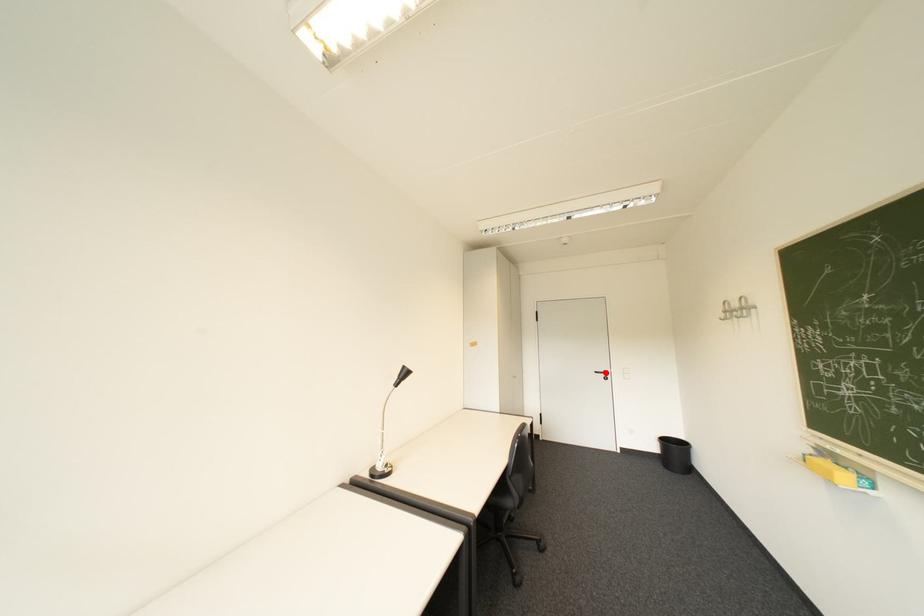
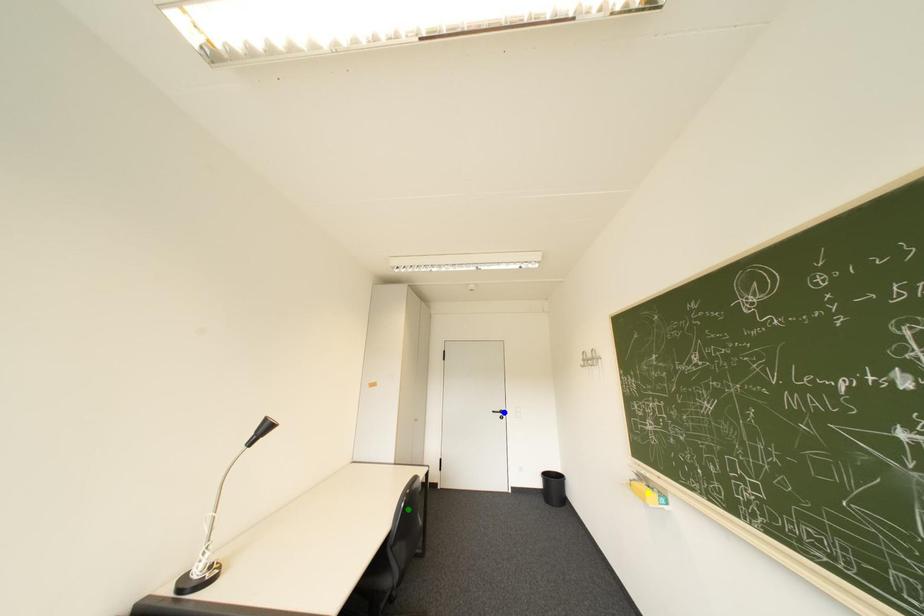
Question: I am providing you with two images of the same scene from different viewpoints. A red point is marked on the first image. You are given multiple points on the second image. In image 2, which mark is for the same physical point as the one in image 1?

Choices:
 (A) blue point
 (B) green point
 (C) yellow point

Answer: (A)